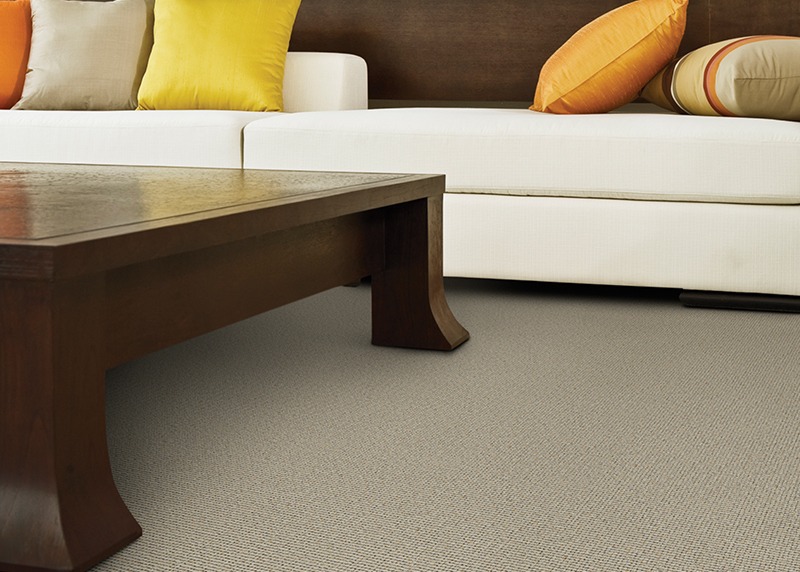
I want to click on cushion, so click(x=442, y=144), click(x=198, y=129), click(x=17, y=39), click(x=106, y=47), click(x=224, y=49), click(x=597, y=49), click(x=766, y=59).